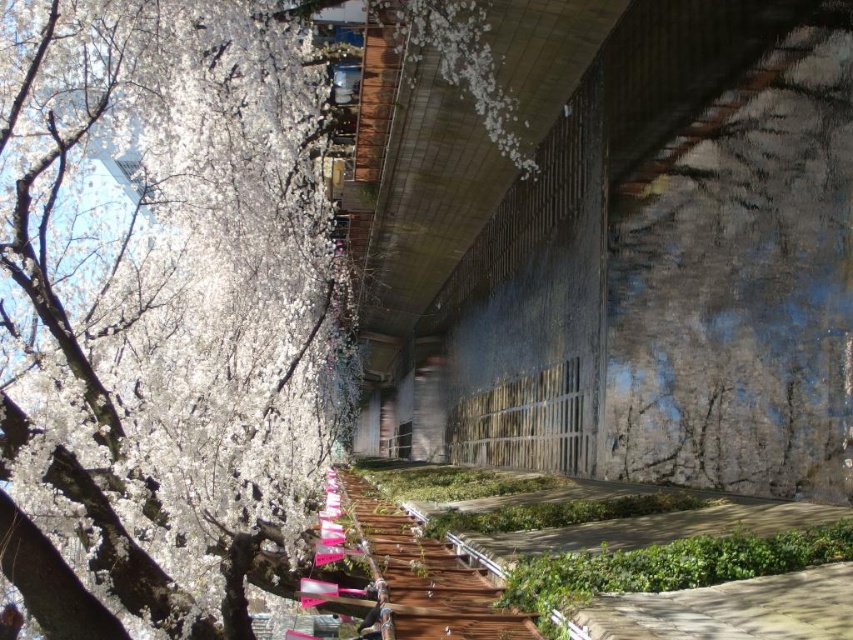
You are a photographer wanting to capture the white blossoms at left and the wooden walkway at center in a single shot. Which object should you focus on first if you want to ensure both are in clear focus?

The white blossoms at left are larger in size compared to the wooden walkway at center. To ensure both are in clear focus, you should focus on the white blossoms at left first, as larger objects often require more precise focus to maintain clarity.

You are standing on the wooden walkway at center and want to take a photo of the white blossoms at left. Which direction should you point your camera to capture them?

You should point your camera to the left side of the wooden walkway at center to capture the white blossoms at left, as they are positioned on the left side of it.